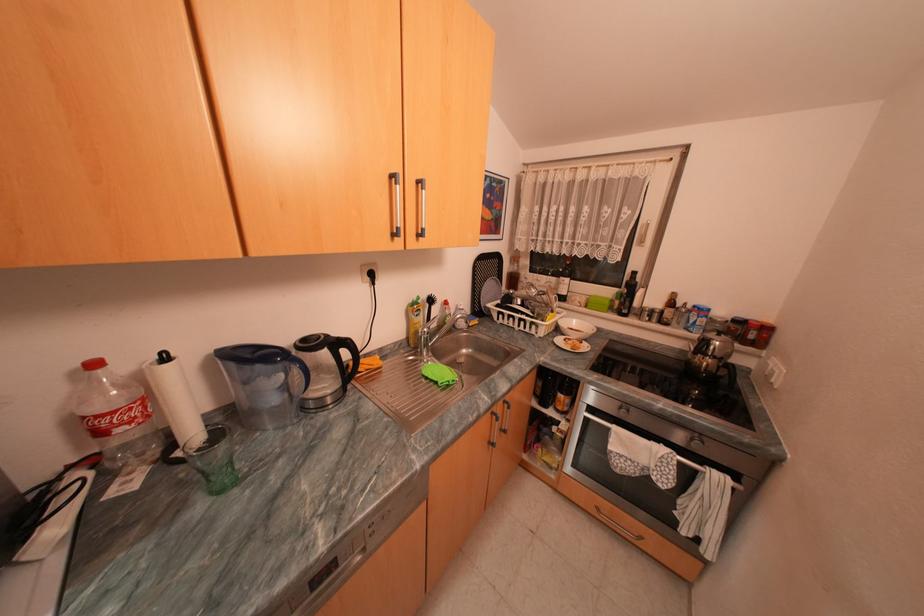
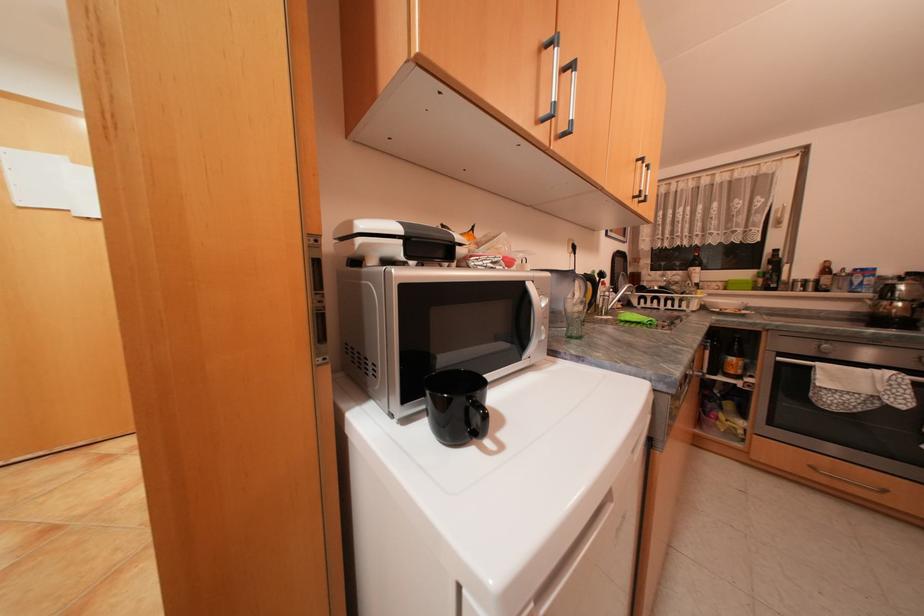
Locate, in the second image, the point that corresponds to (428,297) in the first image.

(602, 270)